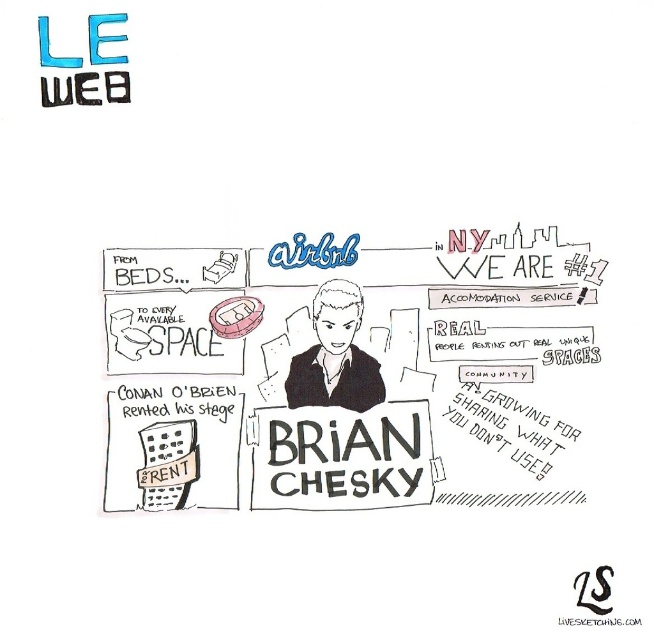
You are looking at the Airbnb illustration and notice two central elements, the black paper sign at center and the black matte portrait at center. Which one is positioned lower in the image?

The black paper sign at center is located below the black matte portrait at center, so the black paper sign at center is positioned lower in the image.

Based on the Airbnb illustration, which of the two points, point (315, 508) or point (370, 362), is closer to the viewer?

Point (315, 508) is in front of point (370, 362), so it is closer to the viewer.

What is the location of the point with coordinates (341, 458) in the image?

The point with coordinates (341, 458) is located on the black paper sign at center.